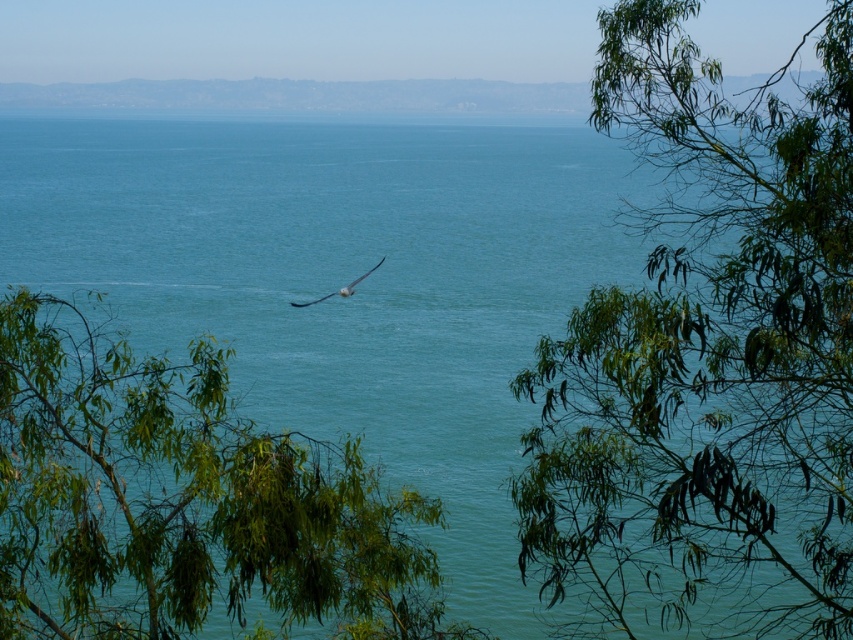
Question: Which of the following is the farthest from the observer?

Choices:
 (A) (294, 301)
 (B) (6, 593)

Answer: (A)

Question: Which point is closer to the camera?

Choices:
 (A) (817, 380)
 (B) (68, 461)

Answer: (A)

Question: Considering the relative positions of green leafy tree at center and white feathered bird at center in the image provided, where is green leafy tree at center located with respect to white feathered bird at center?

Choices:
 (A) above
 (B) below

Answer: (B)

Question: Is green leafy branches at upper right thinner than white feathered bird at center?

Choices:
 (A) yes
 (B) no

Answer: (B)

Question: Is green leafy branches at upper right wider than green leafy tree at center?

Choices:
 (A) no
 (B) yes

Answer: (A)

Question: Among these objects, which one is nearest to the camera?

Choices:
 (A) white feathered bird at center
 (B) green leafy branches at upper right
 (C) green leafy tree at center

Answer: (B)